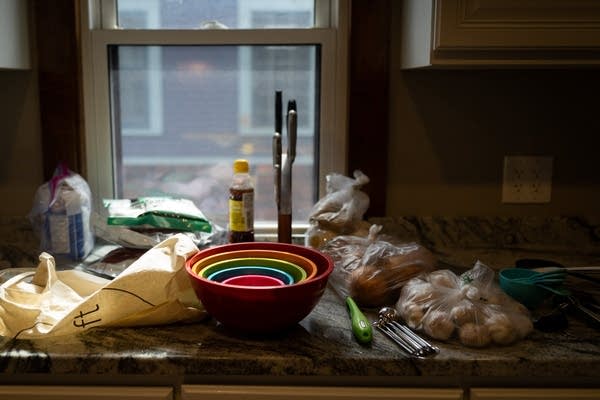
At what (x,y) coordinates should I click in order to perform the action: click on cupboards. Please return your answer as a coordinate pair (x, y). Looking at the image, I should click on pyautogui.click(x=22, y=62), pyautogui.click(x=504, y=45).